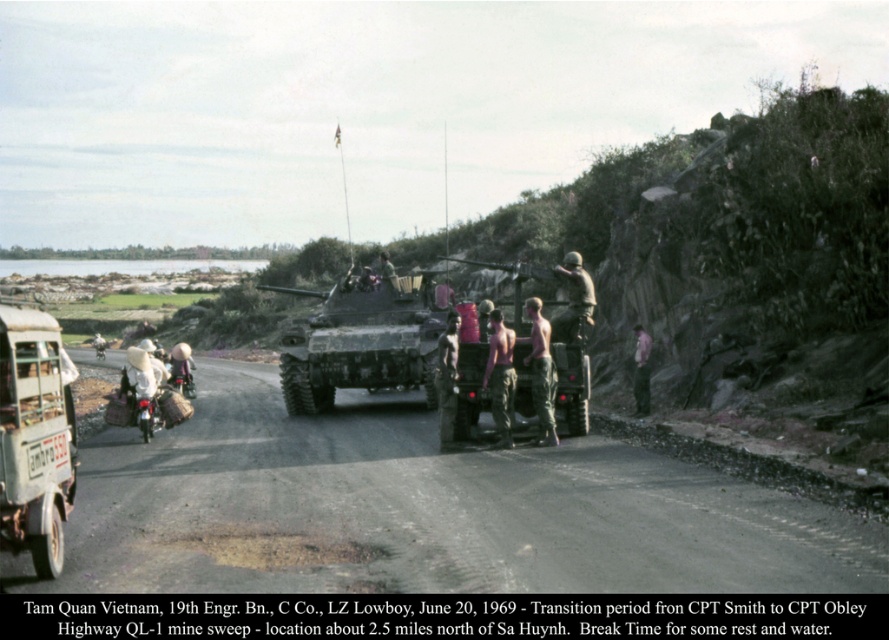
You are a soldier in LZ Lowboy during the Vietnam War. You need to move your equipment to the nearest vehicle. There is a rusty metal truck at lower left. Where is the rusty metal truck located in the scene?

The rusty metal truck at lower left is located at the 2D coordinates point (x=34, y=438) in the scene.

You are a soldier in the 19th Engineer Battalion, C Company, positioned at LZ Lowboy. You notice the rusty metal truck at lower left and the white cloth hat at left. Which object is nearer to your current position?

The rusty metal truck at lower left is closer to the viewer than the white cloth hat at left, so the rusty metal truck at lower left is nearer to your current position.

You are a soldier in the 19th Engineer Battalion, C Company, positioned at LZ Lowboy. You need to transport supplies to a nearby checkpoint. The rusty metal truck at lower left and the white cloth hat at left are visible. Which object can you use to carry the supplies?

The rusty metal truck at lower left is larger in size than the white cloth hat at left, so the rusty metal truck at lower left can be used to carry the supplies as it is bigger and more suitable for transporting items.